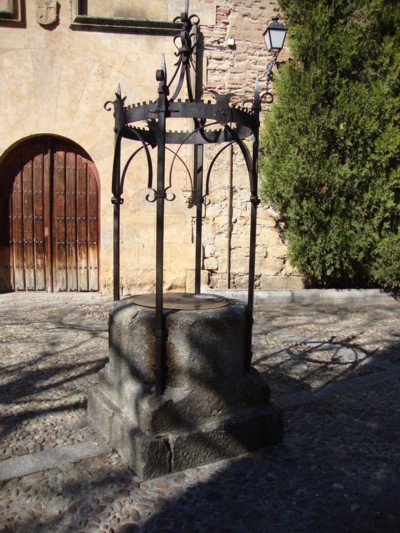
Locate an element on the screen. The height and width of the screenshot is (533, 400). light is located at coordinates (279, 36).